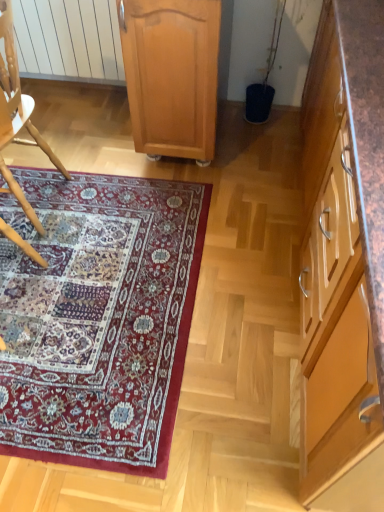
This screenshot has height=512, width=384. I want to click on free space above carpet with intricate patterns at lower left (from a real-world perspective), so click(90, 276).